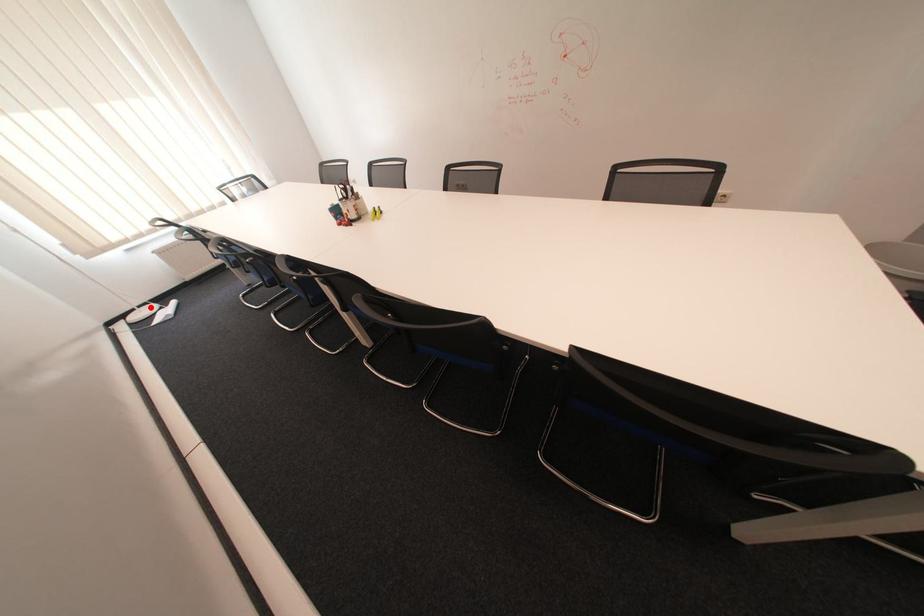
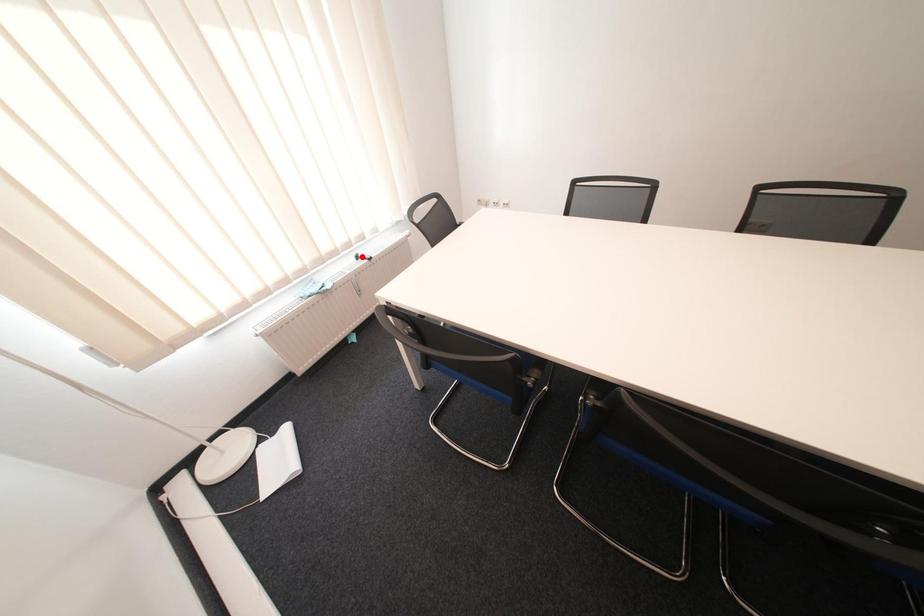
I am providing you with two images of the same scene from different viewpoints. A red point is marked on the first image and another point is marked on the second image. Is the red point in image1 aligned with the point shown in image2?

No